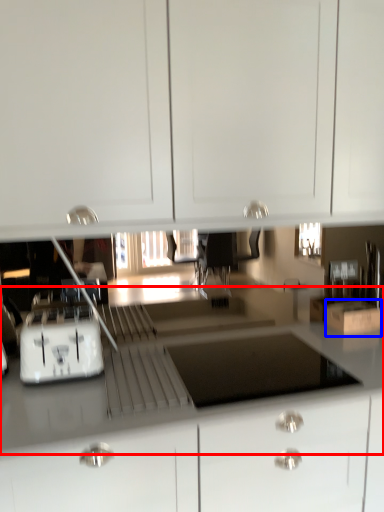
Question: Which point is further to the camera, counter top (highlighted by a red box) or cardboard box (highlighted by a blue box)?

Choices:
 (A) counter top
 (B) cardboard box

Answer: (B)